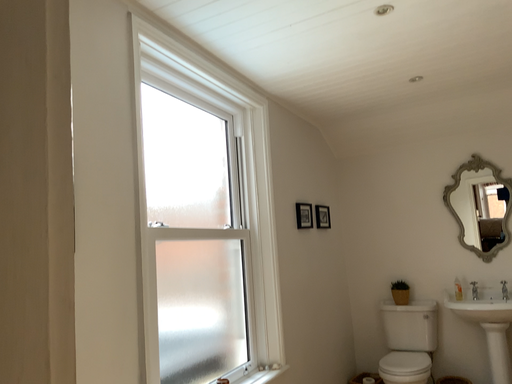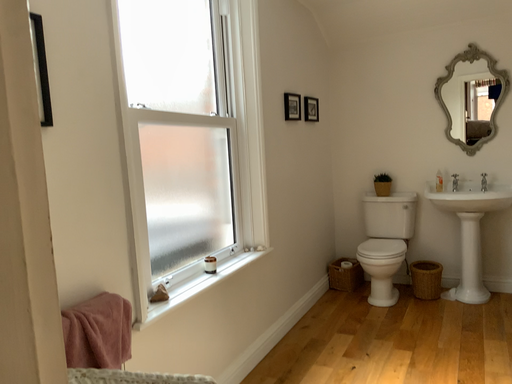
Question: Which way did the camera rotate in the video?

Choices:
 (A) rotated downward
 (B) rotated upward

Answer: (A)